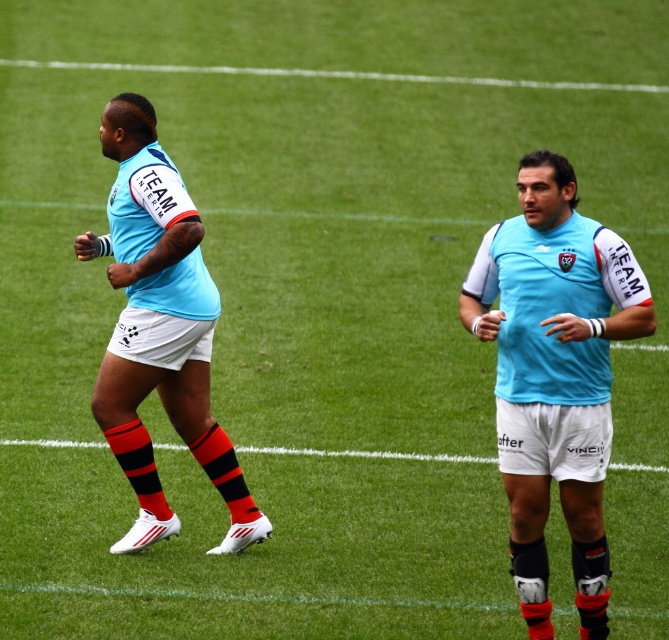
Is light blue jersey at center to the left of light blue jersey at left from the viewer's perspective?

Incorrect, light blue jersey at center is not on the left side of light blue jersey at left.

Based on the photo, is light blue jersey at center positioned at the back of light blue jersey at left?

No, light blue jersey at center is closer to the viewer.

Does point (539, 593) lie behind point (159, 291)?

No, (539, 593) is in front of (159, 291).

Find the location of a particular element. light blue jersey at center is located at coordinates (555, 374).